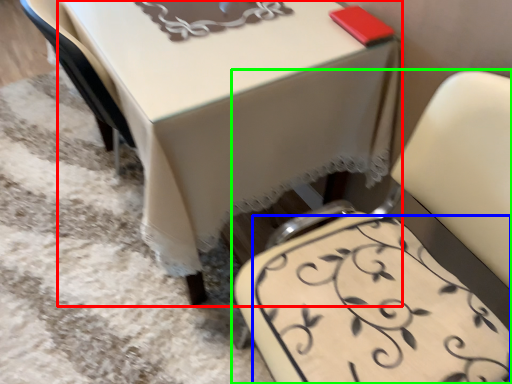
Question: Which object is positioned farthest from table (highlighted by a red box)? Select from design (highlighted by a blue box) and chair (highlighted by a green box).

Choices:
 (A) design
 (B) chair

Answer: (A)